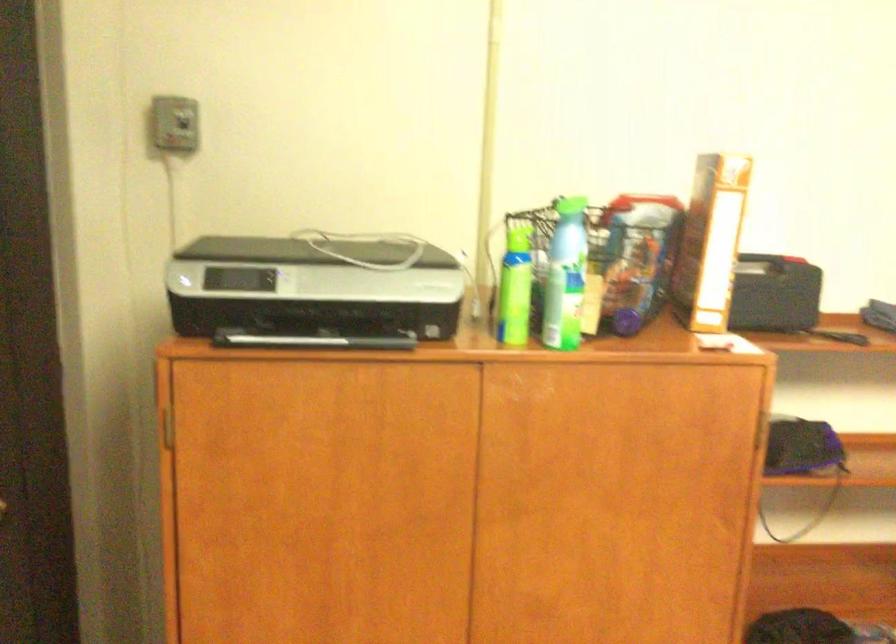
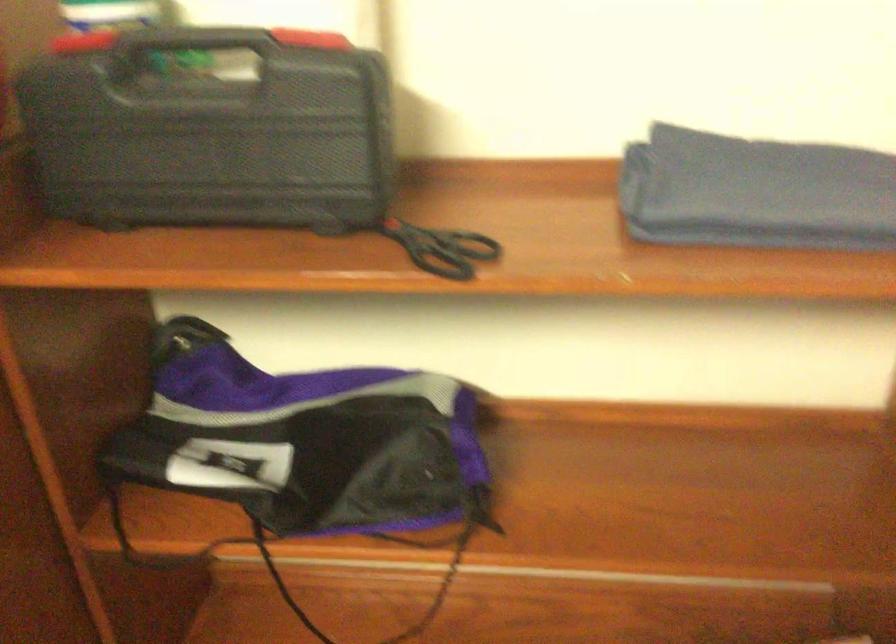
The images are taken continuously from a first-person perspective. In which direction are you moving?

The cameraman walked toward right, forward.